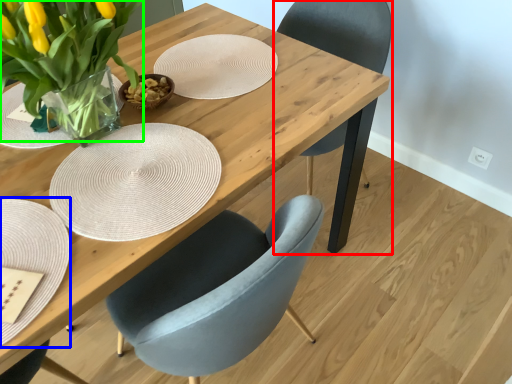
Question: Which is farther away from chair (highlighted by a red box)? plate (highlighted by a blue box) or floral arrangement (highlighted by a green box)?

Choices:
 (A) plate
 (B) floral arrangement

Answer: (A)